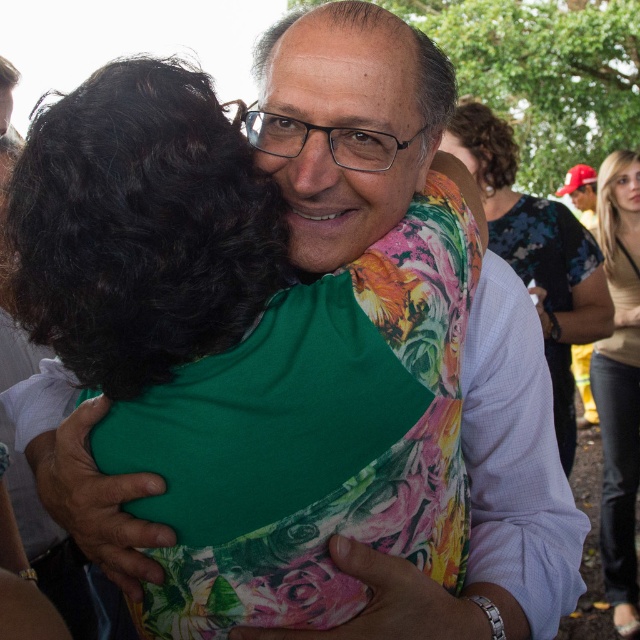
You are at a social event and want to take a photo of the floral fabric dress at center and the light brown leather jacket at right. Which object should you focus on first if you want to capture both in the same frame without moving the camera?

You should focus on the floral fabric dress at center first because it is positioned to the left of the light brown leather jacket at right, so capturing it first ensures both are in the frame without needing to adjust the camera angle.

You are at a social event and want to take a photo of the floral fabric dress at center and the light brown leather jacket at right. Which item will appear larger in the photo if you focus on the dress?

The light brown leather jacket at right will appear larger in the photo because it is taller than the floral fabric dress at center.

You are standing in the center of the scene and want to move towards the floral fabric dress at center. In which direction should you move?

The floral fabric dress at center is located at the center of the scene, so you should move straight ahead towards it.